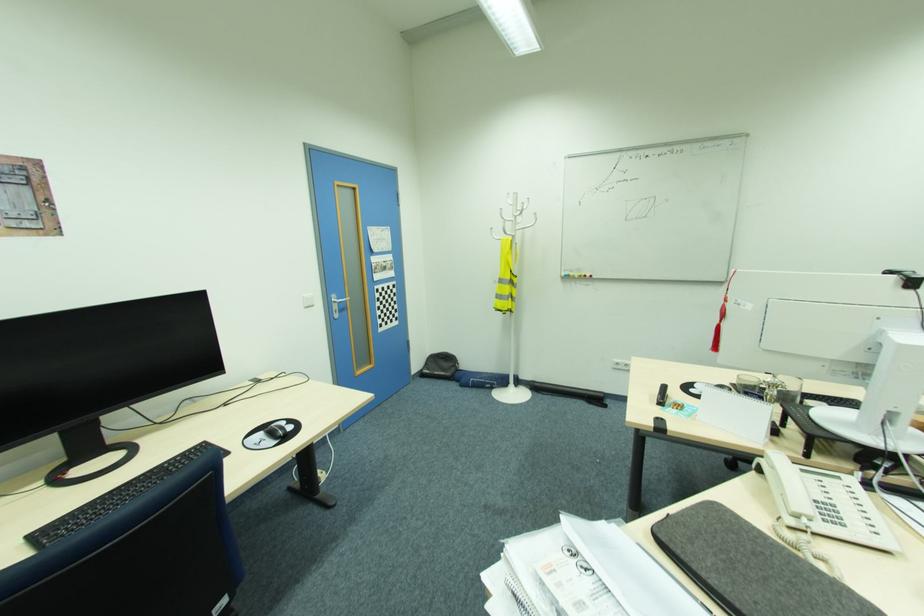
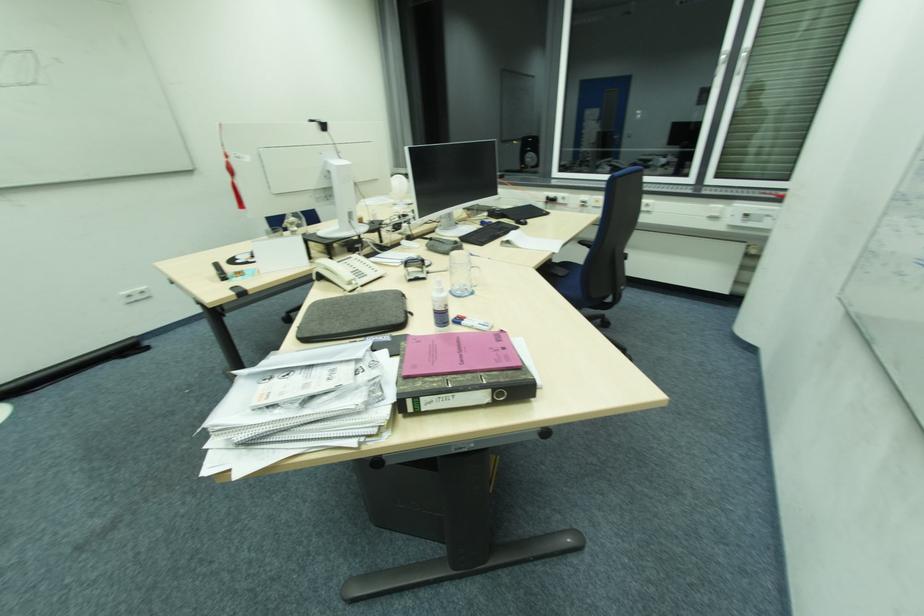
Where in the second image is the point corresponding to point 713,582 from the first image?

(348, 331)